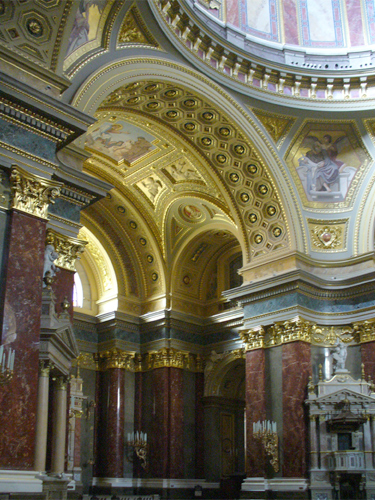
The image size is (375, 500). What are the coordinates of `shadows on crown molding` in the screenshot? It's located at (145, 485).